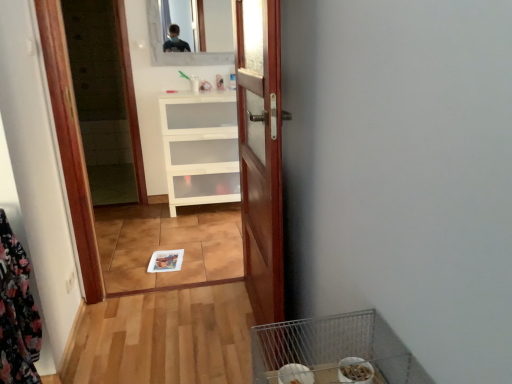
Question: Does clear glass mirror at upper center have a larger size compared to floral fabric laundry at left?

Choices:
 (A) yes
 (B) no

Answer: (B)

Question: Is the position of clear glass mirror at upper center more distant than that of floral fabric laundry at left?

Choices:
 (A) no
 (B) yes

Answer: (B)

Question: From the image's perspective, is clear glass mirror at upper center located beneath floral fabric laundry at left?

Choices:
 (A) no
 (B) yes

Answer: (A)

Question: Is clear glass mirror at upper center facing away from floral fabric laundry at left?

Choices:
 (A) no
 (B) yes

Answer: (A)

Question: From a real-world perspective, is clear glass mirror at upper center beneath floral fabric laundry at left?

Choices:
 (A) no
 (B) yes

Answer: (A)

Question: Considering the positions of metallic wire bird cage at lower right and white matte cabinet at center in the image, is metallic wire bird cage at lower right taller or shorter than white matte cabinet at center?

Choices:
 (A) tall
 (B) short

Answer: (B)

Question: Is point (261, 344) closer or farther from the camera than point (179, 170)?

Choices:
 (A) farther
 (B) closer

Answer: (B)

Question: From a real-world perspective, is metallic wire bird cage at lower right positioned above or below white matte cabinet at center?

Choices:
 (A) above
 (B) below

Answer: (A)

Question: Looking at the image, does metallic wire bird cage at lower right seem bigger or smaller compared to white matte cabinet at center?

Choices:
 (A) small
 (B) big

Answer: (A)

Question: From the image's perspective, is clear glass mirror at upper center positioned above or below metallic wire bird cage at lower right?

Choices:
 (A) below
 (B) above

Answer: (B)

Question: In terms of width, does clear glass mirror at upper center look wider or thinner when compared to metallic wire bird cage at lower right?

Choices:
 (A) wide
 (B) thin

Answer: (B)

Question: Is clear glass mirror at upper center to the left or to the right of metallic wire bird cage at lower right in the image?

Choices:
 (A) right
 (B) left

Answer: (B)

Question: Is point (184, 18) positioned closer to the camera than point (386, 339)?

Choices:
 (A) farther
 (B) closer

Answer: (A)

Question: From the image's perspective, is white matte cabinet at center positioned above or below metallic wire bird cage at lower right?

Choices:
 (A) below
 (B) above

Answer: (B)

Question: Based on their positions, is white matte cabinet at center located to the left or right of metallic wire bird cage at lower right?

Choices:
 (A) left
 (B) right

Answer: (A)